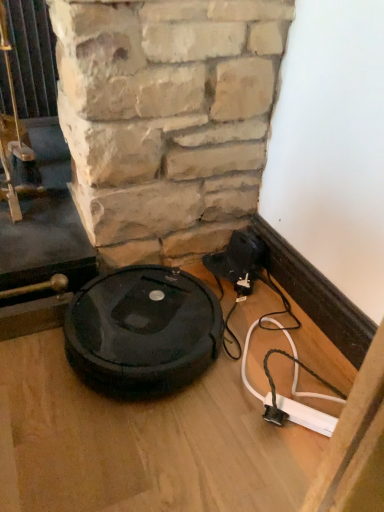
Where is `vacant area that is situated to the right of black plastic robot vacuum cleaner at lower left`? vacant area that is situated to the right of black plastic robot vacuum cleaner at lower left is located at coordinates (270, 354).